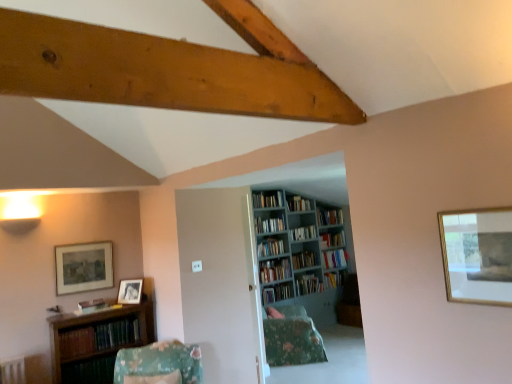
What do you see at coordinates (303, 233) in the screenshot? Image resolution: width=512 pixels, height=384 pixels. I see `hardcover books at center, arranged as the 5th book when viewed from the front` at bounding box center [303, 233].

This screenshot has width=512, height=384. What do you see at coordinates (333, 238) in the screenshot? I see `hardcover book at center, the second book viewed from the back` at bounding box center [333, 238].

What is the approximate width of hardcover book at center, which is the 3th book in back-to-front order?

hardcover book at center, which is the 3th book in back-to-front order, is 21.72 centimeters in width.

This screenshot has height=384, width=512. Describe the element at coordinates (298, 203) in the screenshot. I see `hardcover books at center, the sixth book when ordered from front to back` at that location.

Locate an element on the screen. Image resolution: width=512 pixels, height=384 pixels. gold-framed picture at upper right, positioned as the 1th picture frame in top-to-bottom order is located at coordinates tap(477, 255).

This screenshot has width=512, height=384. Identify the location of hardcover books at center, which is counted as the 5th book, starting from the back. (303, 233).

Does green painted wood bookcase at center turn towards gold-framed picture at upper right, the third picture frame when ordered from bottom to top?

No, green painted wood bookcase at center is not facing towards gold-framed picture at upper right, the third picture frame when ordered from bottom to top.

Based on the photo, which object is thinner, green painted wood bookcase at center or gold-framed picture at upper right, the first picture frame when ordered from front to back?

With smaller width is gold-framed picture at upper right, the first picture frame when ordered from front to back.

Is green painted wood bookcase at center touching gold-framed picture at upper right, the third picture frame when ordered from bottom to top?

No, green painted wood bookcase at center is not touching gold-framed picture at upper right, the third picture frame when ordered from bottom to top.

Choose the correct answer: Is green painted wood bookcase at center inside gold-framed picture at upper right, the first picture frame positioned from the right, or outside it?

green painted wood bookcase at center cannot be found inside gold-framed picture at upper right, the first picture frame positioned from the right.

Can we say gold-framed picture at upper right, the third picture frame when ordered from bottom to top, lies outside green painted wood bookcase at center?

Yes.

From a real-world perspective, which object rests below the other?

green painted wood bookcase at center, from a real-world perspective.

Consider the image. Are gold-framed picture at upper right, the 3th picture frame in the back-to-front sequence, and green painted wood bookcase at center far apart?

gold-framed picture at upper right, the 3th picture frame in the back-to-front sequence, is far away from green painted wood bookcase at center.

Considering the positions of objects gold-framed picture at upper right, the first picture frame when ordered from front to back, and green painted wood bookcase at center in the image provided, who is more to the right, gold-framed picture at upper right, the first picture frame when ordered from front to back, or green painted wood bookcase at center?

From the viewer's perspective, green painted wood bookcase at center appears more on the right side.

Is the position of hardcover book at center, positioned as the first book in back-to-front order, less distant than that of hardcover book at center, which is the third book in front-to-back order?

No, it is behind hardcover book at center, which is the third book in front-to-back order.

Is hardcover book at center, positioned as the first book in back-to-front order, located outside hardcover book at center, positioned as the 7th book in back-to-front order?

Indeed, hardcover book at center, positioned as the first book in back-to-front order, is completely outside hardcover book at center, positioned as the 7th book in back-to-front order.

Considering the relative positions of hardcover book at center, positioned as the ninth book in front-to-back order, and hardcover book at center, positioned as the 7th book in back-to-front order, in the image provided, is hardcover book at center, positioned as the ninth book in front-to-back order, to the left or to the right of hardcover book at center, positioned as the 7th book in back-to-front order,?

Based on their positions, hardcover book at center, positioned as the ninth book in front-to-back order, is located to the right of hardcover book at center, positioned as the 7th book in back-to-front order.

Looking at this image, from a real-world perspective, between hardcover book at center, positioned as the first book in back-to-front order, and hardcover book at center, which is the third book in front-to-back order, who is vertically higher?

hardcover book at center, positioned as the first book in back-to-front order, from a real-world perspective.

Which is less distant, [288,202] or [134,339]?

The point [134,339] is more forward.

Are hardcover books at center, the sixth book when ordered from front to back, and hardcover books at lower left, arranged as the second book when viewed from the front, far apart?

Yes.

Between hardcover books at center, which appears as the 4th book when viewed from the back, and hardcover books at lower left, which is the eighth book in back-to-front order, which one has more height?

With more height is hardcover books at center, which appears as the 4th book when viewed from the back.

Based on the photo, from the image's perspective, between hardcover books at center, the sixth book when ordered from front to back, and hardcover books at lower left, which is the eighth book in back-to-front order, who is located below?

hardcover books at lower left, which is the eighth book in back-to-front order, is shown below in the image.

Which is behind, point (96, 338) or point (295, 207)?

Positioned behind is point (295, 207).

Considering the relative positions of hardcover books at lower left, which is the eighth book in back-to-front order, and hardcover books at center, the sixth book when ordered from front to back, in the image provided, is hardcover books at lower left, which is the eighth book in back-to-front order, in front of hardcover books at center, the sixth book when ordered from front to back,?

That is True.

From the image's perspective, is hardcover books at lower left, arranged as the second book when viewed from the front, located beneath hardcover books at center, which appears as the 4th book when viewed from the back?

Yes, from the image's perspective, hardcover books at lower left, arranged as the second book when viewed from the front, is beneath hardcover books at center, which appears as the 4th book when viewed from the back.

Which is further, (308, 277) or (118, 334)?

The point (308, 277) is more distant.

Is hardcover book at center, positioned as the 7th book in back-to-front order, far from hardcover books at lower left, which is the eighth book in back-to-front order?

Yes.

What are the coordinates of `the 2nd picture frame in front when counting from the hardcover book at center, positioned as the first book in back-to-front order` in the screenshot? It's located at (83, 267).

From a real-world perspective, is matte wooden picture frame at left, the 3th picture frame viewed from the right, under hardcover book at center, positioned as the first book in back-to-front order?

Incorrect, from a real-world perspective, matte wooden picture frame at left, the 3th picture frame viewed from the right, is higher than hardcover book at center, positioned as the first book in back-to-front order.

Can you tell me how much matte wooden picture frame at left, which appears as the second picture frame when viewed from the back, and hardcover book at center, positioned as the ninth book in front-to-back order, differ in facing direction?

The facing directions of matte wooden picture frame at left, which appears as the second picture frame when viewed from the back, and hardcover book at center, positioned as the ninth book in front-to-back order, are 2.34 degrees apart.

Identify the location of the 3rd picture frame directly above the green painted wood bookcase at center (from a real-world perspective). (477, 255).

From the image's perspective, which picture frame is the 3rd one above the green painted wood bookcase at center? Please provide its 2D coordinates.

[(477, 255)]

Based on their spatial positions, is floral fabric pillow at center or hardcover book at center, positioned as the ninth book in front-to-back order, further from hardcover books at center, which appears as the 4th book when viewed from the back?

The object further to hardcover books at center, which appears as the 4th book when viewed from the back, is floral fabric pillow at center.

Looking at the image, which one is located closer to hardcover books at center, the 4th book from the front, hardcover books at center, arranged as the 5th book when viewed from the front, or hardcover books at center, which appears as the 4th book when viewed from the back?

hardcover books at center, arranged as the 5th book when viewed from the front.

When comparing their distances from wooden bookshelf at lower left, does green painted wood bookcase at center or hardcover books at center, the 4th book from the front, seem closer?

green painted wood bookcase at center is positioned closer to the anchor wooden bookshelf at lower left.

Looking at the image, which one is located closer to gold-framed picture at upper right, marked as the third picture frame in a left-to-right arrangement, green painted wood bookcase at center or matte wooden picture frame at left, the 1th picture frame when ordered from left to right?

The object closer to gold-framed picture at upper right, marked as the third picture frame in a left-to-right arrangement, is matte wooden picture frame at left, the 1th picture frame when ordered from left to right.

Based on their spatial positions, is hardcover book at center, which is the 3th book in back-to-front order, or hardcover books at lower left, arranged as the second book when viewed from the front, further from green painted wood bookcase at center?

Among the two, hardcover books at lower left, arranged as the second book when viewed from the front, is located further to green painted wood bookcase at center.

When comparing their distances from hardcover books at lower left, arranged as the second book when viewed from the front, does hardcover books at center, arranged as the 5th book when viewed from the front, or gold-framed picture at upper right, the first picture frame when ordered from front to back, seem further?

gold-framed picture at upper right, the first picture frame when ordered from front to back, is positioned further to the anchor hardcover books at lower left, arranged as the second book when viewed from the front.

Estimate the real-world distances between objects in this image. Which object is further from green painted wood bookcase at center, hardcover book at center, positioned as the first book in back-to-front order, or gold-framed picture at upper right, the 3th picture frame in the back-to-front sequence?

gold-framed picture at upper right, the 3th picture frame in the back-to-front sequence, is positioned further to the anchor green painted wood bookcase at center.

Estimate the real-world distances between objects in this image. Which object is closer to matte wooden picture frame at left, which appears as the second picture frame when viewed from the back, hardcover book at center, positioned as the first book in back-to-front order, or matte black picture frame at lower left, the 3th picture frame when ordered from top to bottom?

The object closer to matte wooden picture frame at left, which appears as the second picture frame when viewed from the back, is matte black picture frame at lower left, the 3th picture frame when ordered from top to bottom.

The width and height of the screenshot is (512, 384). Identify the location of bookcase between matte wooden picture frame at left, the 3th picture frame viewed from the right, and hardcover book at center, positioned as the 7th book in back-to-front order, in the front-back direction. (293, 246).

What are the coordinates of `shelf between gold-framed picture at upper right, the first picture frame positioned from the right, and hardcover books at center, which is counted as the 5th book, starting from the back, along the z-axis` in the screenshot? It's located at (97, 341).

Locate an element on the screen. pillow between hardcover books at lower left, arranged as the second book when viewed from the front, and hardcover book at center, which is the third book in front-to-back order, from front to back is located at coordinates tap(291, 337).

Locate an element on the screen. The height and width of the screenshot is (384, 512). pillow positioned between hardcover book at lower left, the 1th book positioned from the front, and green painted wood bookcase at center from near to far is located at coordinates (291, 337).